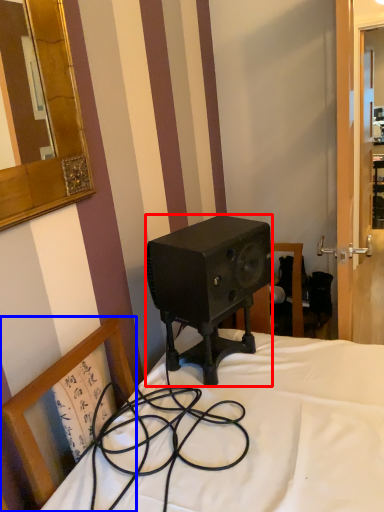
Question: Which of the following is the closest to the observer, speaker (highlighted by a red box) or chair (highlighted by a blue box)?

Choices:
 (A) speaker
 (B) chair

Answer: (B)